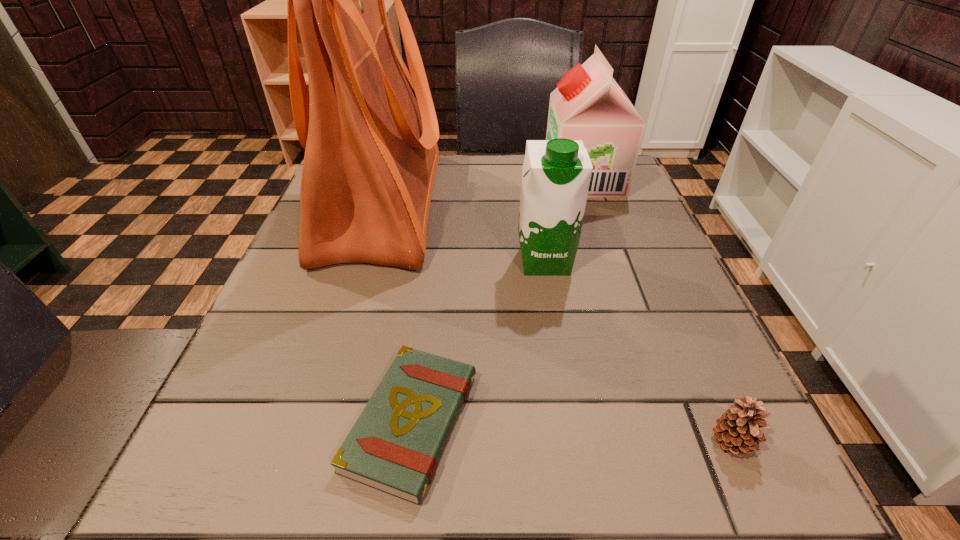
Identify the location of vacant space located 0.070m on the left of the fourth tallest object. This screenshot has height=540, width=960. (658, 443).

Locate an element on the screen. The height and width of the screenshot is (540, 960). vacant space located 0.290m on the back of the book is located at coordinates (434, 243).

The width and height of the screenshot is (960, 540). Find the location of `shopping bag at the far edge`. shopping bag at the far edge is located at coordinates (369, 129).

Find the location of a particular element. The image size is (960, 540). soya milk situated at the far edge is located at coordinates (588, 104).

The width and height of the screenshot is (960, 540). Identify the location of pinecone at the near edge. (737, 429).

At what (x,y) coordinates should I click in order to perform the action: click on book present at the near edge. Please return your answer as a coordinate pair (x, y). This screenshot has height=540, width=960. Looking at the image, I should click on click(x=394, y=446).

Image resolution: width=960 pixels, height=540 pixels. What are the coordinates of `object at the left edge` in the screenshot? It's located at (369, 129).

Where is `soya milk that is at the right edge`? The image size is (960, 540). soya milk that is at the right edge is located at coordinates (588, 104).

What are the coordinates of `pinecone at the right edge` in the screenshot? It's located at (737, 429).

Locate an element on the screen. The image size is (960, 540). object at the far left corner is located at coordinates (369, 129).